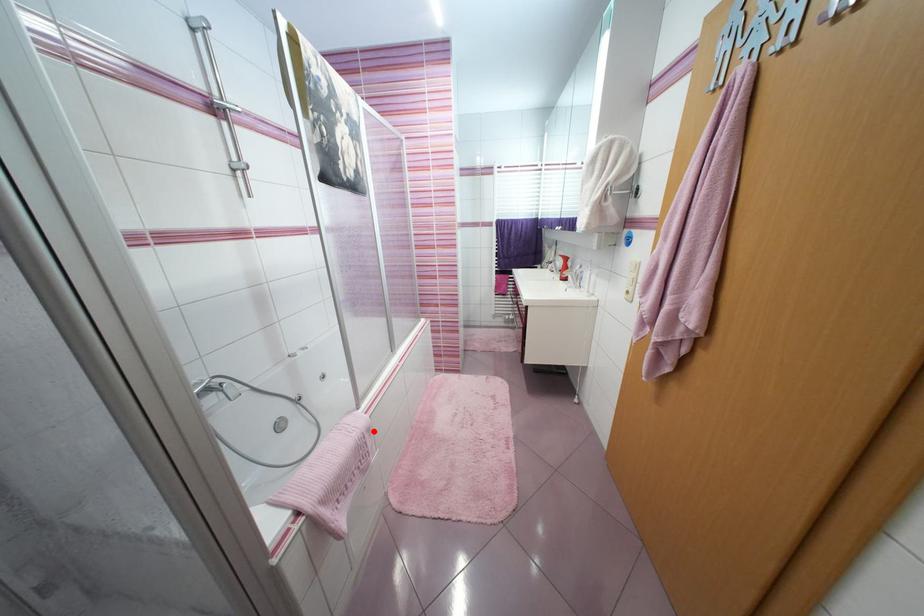
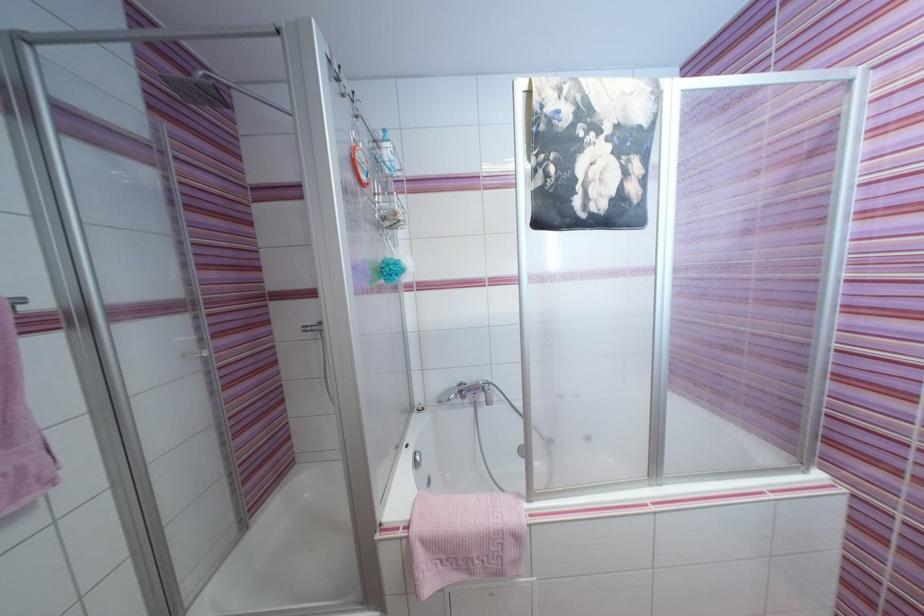
Find the pixel in the second image that matches the highlighted location in the first image.

(521, 539)